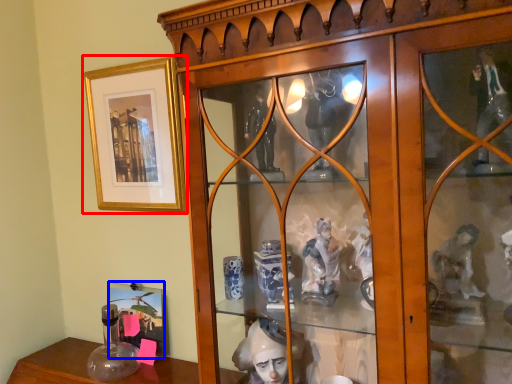
Question: Among these objects, which one is farthest to the camera, picture frame (highlighted by a red box) or picture frame (highlighted by a blue box)?

Choices:
 (A) picture frame
 (B) picture frame

Answer: (B)